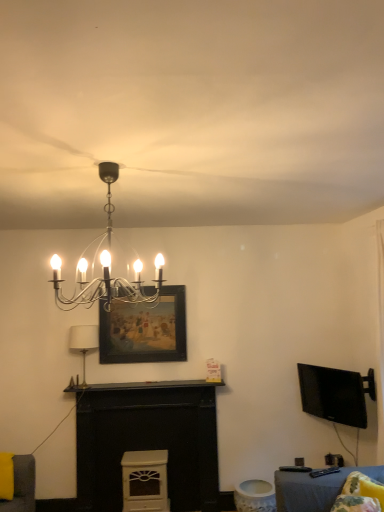
Question: From the image's perspective, is polished chrome chandelier at upper center, which is the first lamp in front-to-back order, above or below white matte fireplace at center?

Choices:
 (A) above
 (B) below

Answer: (A)

Question: In the image, is polished chrome chandelier at upper center, which is the first lamp in front-to-back order, positioned in front of or behind white matte fireplace at center?

Choices:
 (A) front
 (B) behind

Answer: (A)

Question: Considering the real-world distances, which object is farthest from the white matte fireplace at center?

Choices:
 (A) wooden framed painting at center
 (B) black glossy tv at right
 (C) polished chrome chandelier at upper center, placed as the first lamp when sorted from top to bottom
 (D) fluffy yellow pillow at lower right
 (E) white fabric lampshade at center-left, which is the first lamp in back-to-front order

Answer: (D)

Question: Estimate the real-world distances between objects in this image. Which object is closer to the black glossy tv at right?

Choices:
 (A) white fabric lampshade at center-left, the 2th lamp positioned from the top
 (B) white matte fireplace at center
 (C) wooden framed painting at center
 (D) polished chrome chandelier at upper center, placed as the 2th lamp when sorted from back to front
 (E) fluffy yellow pillow at lower right

Answer: (E)